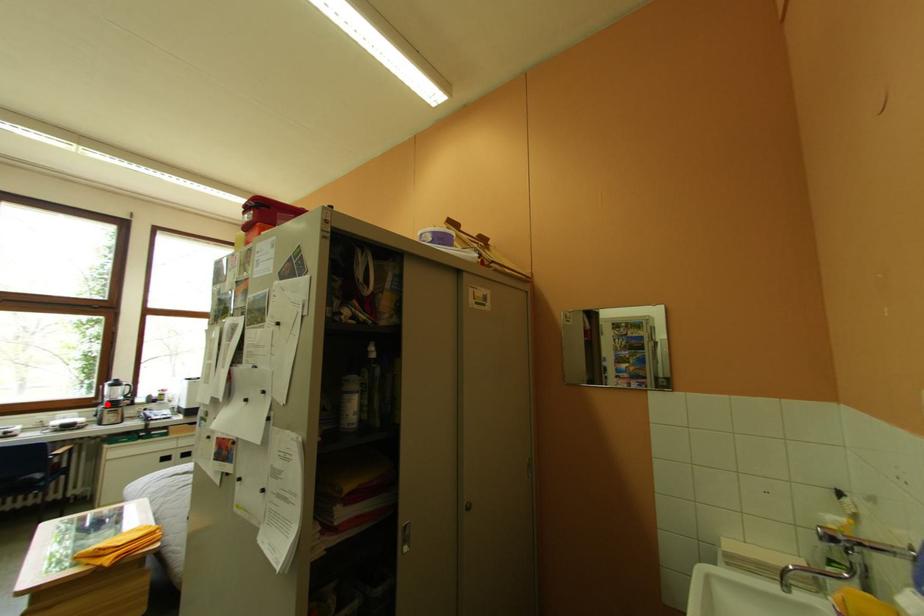
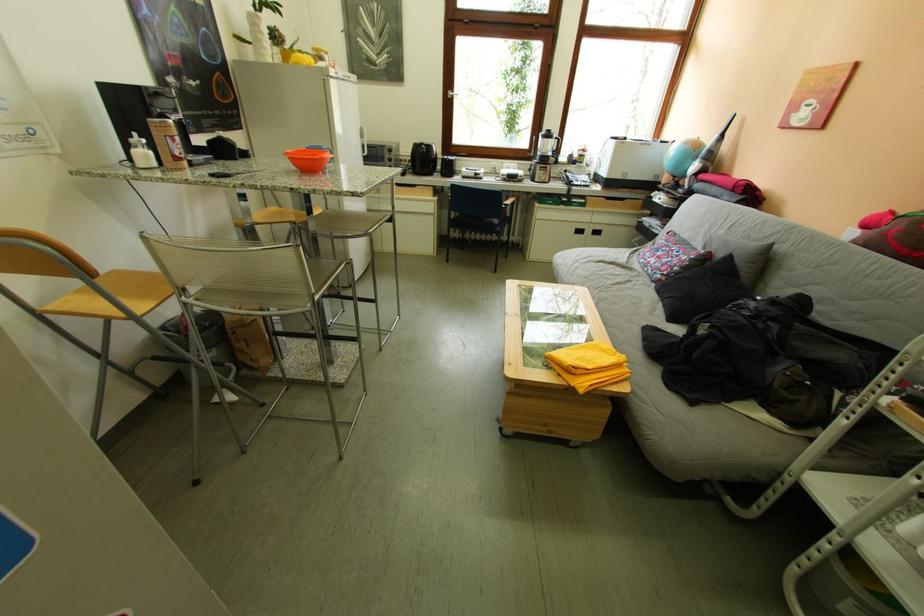
In the second image, find the point that corresponds to the highlighted location in the first image.

(541, 156)